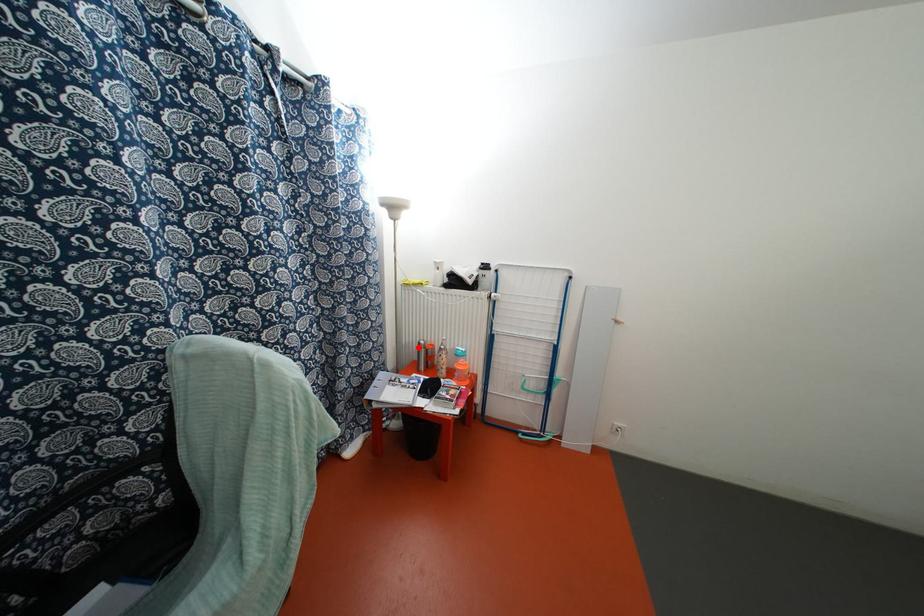
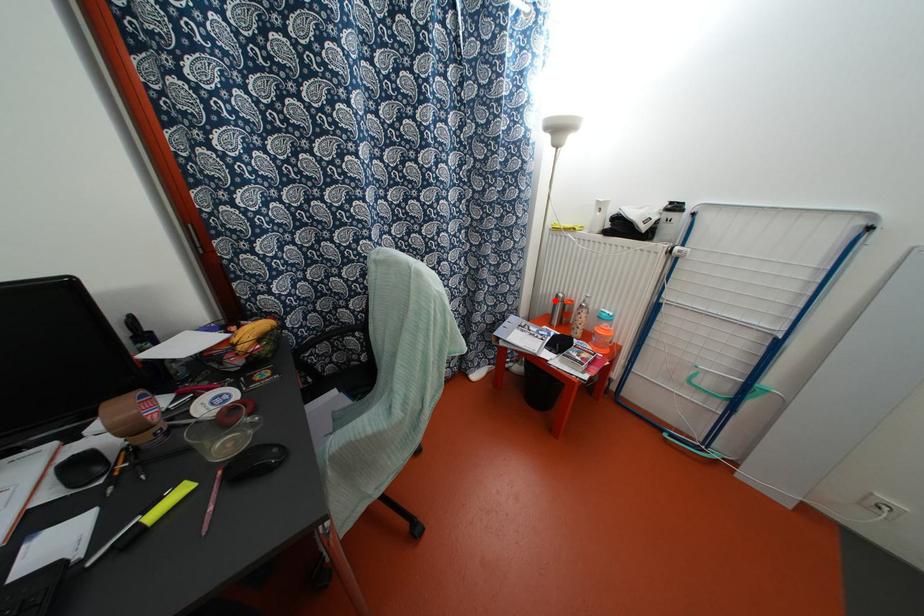
I am providing you with two images of the same scene from different viewpoints. A red point is marked on the first image and another point is marked on the second image. Is the red point in image1 aligned with the point shown in image2?

Yes